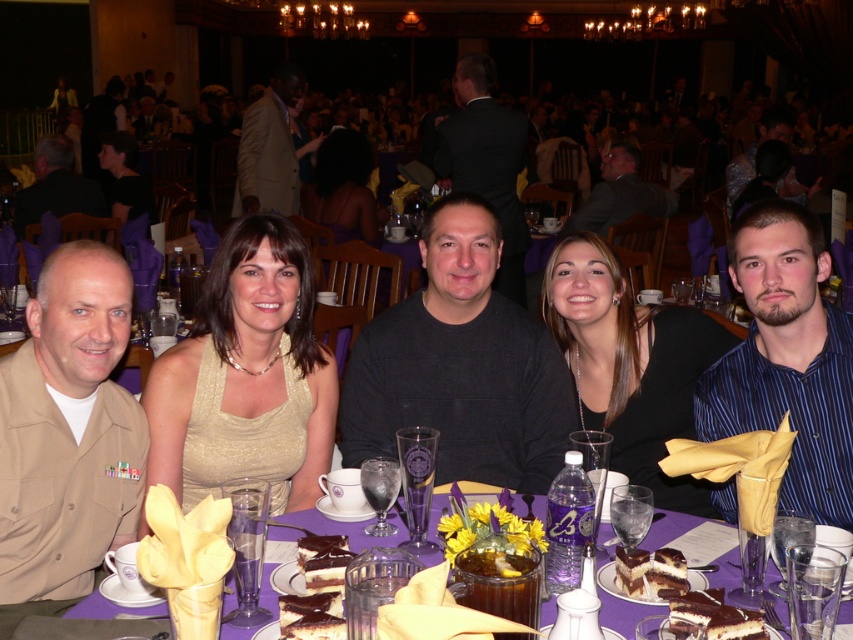
Does blue striped shirt at center appear on the left side of black silk dress at center?

In fact, blue striped shirt at center is to the right of black silk dress at center.

Who is more forward, (747, 349) or (670, 426)?

Point (747, 349)

Which is behind, point (801, 445) or point (618, 308)?

Point (618, 308)

In order to click on blue striped shirt at center in this screenshot , I will do `click(787, 358)`.

Which is more to the left, black matte suit at upper center or chocolate frosted cake at lower center?

black matte suit at upper center

Image resolution: width=853 pixels, height=640 pixels. Identify the location of black matte suit at upper center. (486, 163).

Is point (477, 176) positioned in front of point (665, 595)?

No, (477, 176) is further to viewer.

Identify the location of black matte suit at upper center. (486, 163).

In the scene shown: Which of these two, black silk dress at center or dark gray suit at center, stands taller?

dark gray suit at center is taller.

Between black silk dress at center and dark gray suit at center, which one appears on the right side from the viewer's perspective?

From the viewer's perspective, dark gray suit at center appears more on the right side.

Which is behind, point (613, 451) or point (651, 211)?

Point (651, 211)

You are a GUI agent. You are given a task and a screenshot of the screen. Output one action in this format:
    pyautogui.click(x=<x>, y=<y>)
    Task: Click on the black silk dress at center
    This screenshot has height=640, width=853.
    Given the screenshot: What is the action you would take?
    pyautogui.click(x=630, y=364)